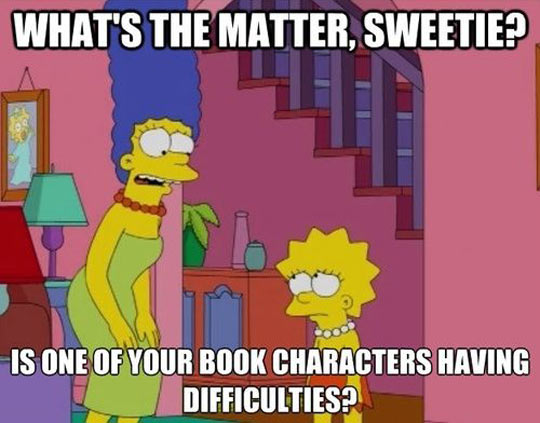
At what (x,y) coordinates should I click in order to perform the action: click on lamp. Please return your answer as a coordinate pair (x, y). The image size is (540, 423). Looking at the image, I should click on (55, 207).